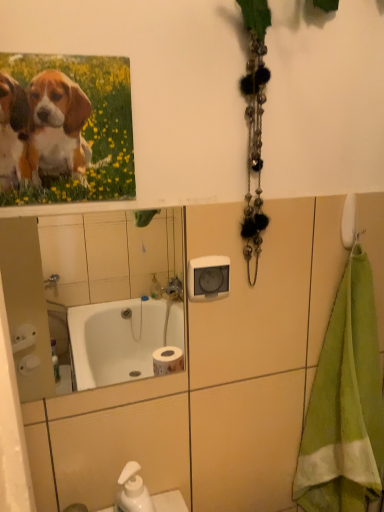
You are a GUI agent. You are given a task and a screenshot of the screen. Output one action in this format:
    pyautogui.click(x=<x>, y=<y>)
    Task: Click on the white glossy mirror at upper center
    The image size is (384, 512).
    Given the screenshot: What is the action you would take?
    [87, 295]

What do you see at coordinates (345, 404) in the screenshot?
I see `green terry cloth towel at right` at bounding box center [345, 404].

I want to click on green terry cloth towel at right, so click(x=345, y=404).

I want to click on matte canvas print of puppies at upper left, so pos(70,126).

Is white glossy mirror at upper center positioned far away from green terry cloth towel at right?

Yes, white glossy mirror at upper center and green terry cloth towel at right are located far from each other.

Who is taller, white glossy mirror at upper center or green terry cloth towel at right?

green terry cloth towel at right is taller.

Is white glossy mirror at upper center outside of green terry cloth towel at right?

white glossy mirror at upper center lies outside green terry cloth towel at right's area.

Is white glossy mirror at upper center facing away from green terry cloth towel at right?

No, white glossy mirror at upper center's orientation is not away from green terry cloth towel at right.

Is white glossy mirror at upper center turned away from matte canvas print of puppies at upper left?

No, white glossy mirror at upper center is not facing away from matte canvas print of puppies at upper left.

Which object is wider, white glossy mirror at upper center or matte canvas print of puppies at upper left?

With larger width is matte canvas print of puppies at upper left.

Does white glossy mirror at upper center appear on the left side of matte canvas print of puppies at upper left?

Correct, you'll find white glossy mirror at upper center to the left of matte canvas print of puppies at upper left.

Could you measure the distance between white glossy mirror at upper center and matte canvas print of puppies at upper left?

The distance of white glossy mirror at upper center from matte canvas print of puppies at upper left is 5.24 feet.

Does matte canvas print of puppies at upper left have a greater height compared to white glossy mirror at upper center?

No.

Based on their sizes in the image, would you say matte canvas print of puppies at upper left is bigger or smaller than white glossy mirror at upper center?

In the image, matte canvas print of puppies at upper left appears to be smaller than white glossy mirror at upper center.

Is matte canvas print of puppies at upper left wider than white glossy mirror at upper center?

Yes, matte canvas print of puppies at upper left is wider than white glossy mirror at upper center.

Would you consider matte canvas print of puppies at upper left to be distant from white glossy mirror at upper center?

matte canvas print of puppies at upper left is far away from white glossy mirror at upper center.

Which is behind, point (337, 348) or point (105, 217)?

Positioned behind is point (105, 217).

Is white glossy mirror at upper center located within green terry cloth towel at right?

No, white glossy mirror at upper center is not inside green terry cloth towel at right.

Visually, is green terry cloth towel at right positioned to the left or to the right of white glossy mirror at upper center?

Based on their positions, green terry cloth towel at right is located to the right of white glossy mirror at upper center.

Considering the points (350, 443) and (46, 97), which point is behind, point (350, 443) or point (46, 97)?

The point (350, 443) is more distant.

The width and height of the screenshot is (384, 512). Identify the location of flower that appears above the green terry cloth towel at right (from a real-world perspective). (70, 126).

Which object is thinner, green terry cloth towel at right or matte canvas print of puppies at upper left?

Thinner between the two is matte canvas print of puppies at upper left.

What's the angular difference between matte canvas print of puppies at upper left and green terry cloth towel at right's facing directions?

0.00574 degrees separate the facing orientations of matte canvas print of puppies at upper left and green terry cloth towel at right.

Considering the sizes of objects matte canvas print of puppies at upper left and green terry cloth towel at right in the image provided, who is bigger, matte canvas print of puppies at upper left or green terry cloth towel at right?

Bigger between the two is green terry cloth towel at right.

Is matte canvas print of puppies at upper left closer to the viewer compared to green terry cloth towel at right?

Yes, matte canvas print of puppies at upper left is closer to the camera.

Considering the relative sizes of matte canvas print of puppies at upper left and green terry cloth towel at right in the image provided, is matte canvas print of puppies at upper left shorter than green terry cloth towel at right?

Indeed, matte canvas print of puppies at upper left has a lesser height compared to green terry cloth towel at right.

The height and width of the screenshot is (512, 384). Find the location of `bath towel below the white glossy mirror at upper center (from the image's perspective)`. bath towel below the white glossy mirror at upper center (from the image's perspective) is located at coordinates (345, 404).

I want to click on flower lying above the white glossy mirror at upper center (from the image's perspective), so click(x=70, y=126).

Based on their spatial positions, is green terry cloth towel at right or matte canvas print of puppies at upper left further from white glossy mirror at upper center?

The object further to white glossy mirror at upper center is matte canvas print of puppies at upper left.

Looking at the image, which one is located closer to white glossy mirror at upper center, matte canvas print of puppies at upper left or green terry cloth towel at right?

green terry cloth towel at right is positioned closer to the anchor white glossy mirror at upper center.

Based on their spatial positions, is white glossy mirror at upper center or green terry cloth towel at right closer to matte canvas print of puppies at upper left?

Based on the image, green terry cloth towel at right appears to be nearer to matte canvas print of puppies at upper left.

Based on their spatial positions, is matte canvas print of puppies at upper left or white glossy mirror at upper center closer to green terry cloth towel at right?

Among the two, matte canvas print of puppies at upper left is located nearer to green terry cloth towel at right.

Based on their spatial positions, is green terry cloth towel at right or white glossy mirror at upper center closer to matte canvas print of puppies at upper left?

green terry cloth towel at right is closer to matte canvas print of puppies at upper left.

When comparing their distances from green terry cloth towel at right, does white glossy mirror at upper center or matte canvas print of puppies at upper left seem closer?

matte canvas print of puppies at upper left is closer to green terry cloth towel at right.

At what (x,y) coordinates should I click in order to perform the action: click on flower between white glossy mirror at upper center and green terry cloth towel at right in the horizontal direction. Please return your answer as a coordinate pair (x, y). Looking at the image, I should click on (70, 126).